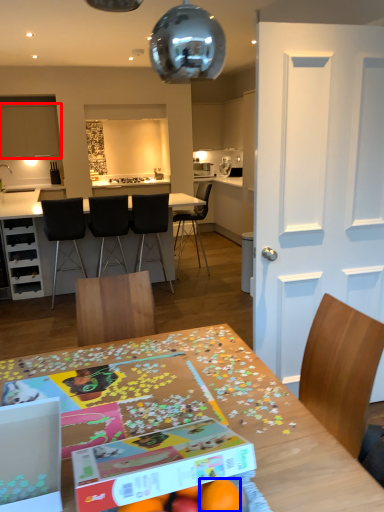
Question: Which point is further to the camera, cabinetry (highlighted by a red box) or orange (highlighted by a blue box)?

Choices:
 (A) cabinetry
 (B) orange

Answer: (A)